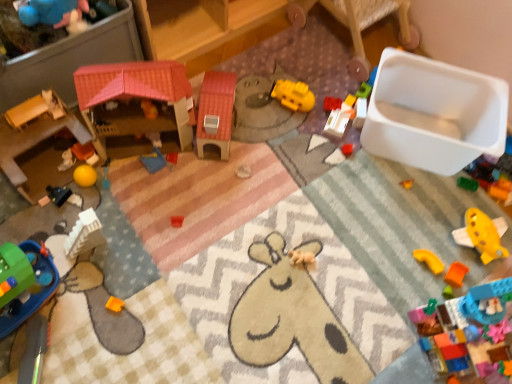
You are a GUI agent. You are given a task and a screenshot of the screen. Output one action in this format:
    pyautogui.click(x=<x>, y=<y>)
    Task: Click on the vacant space in between bright red plastic blocks at center, which ranks as the ninth toy in left-to-right order, and blue plastic tray at center, acting as the 6th toy starting from the left
    
    Given the screenshot: What is the action you would take?
    pyautogui.click(x=251, y=137)